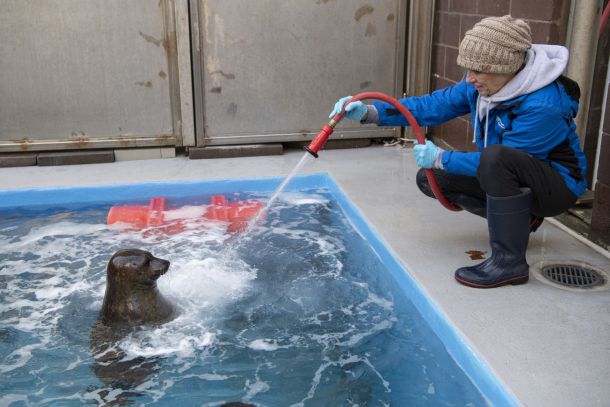
The height and width of the screenshot is (407, 610). What are the coordinates of `hood` in the screenshot? It's located at (535, 74).